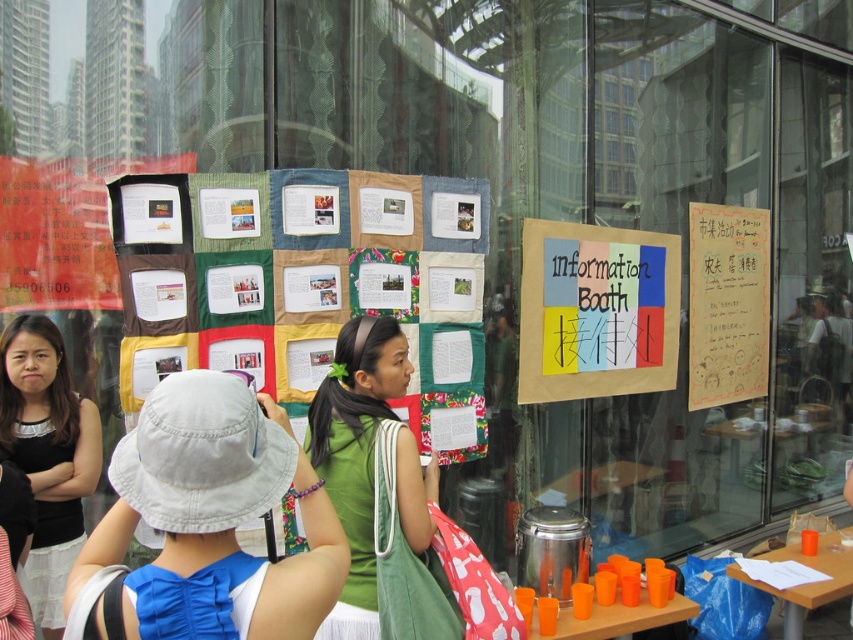
You are a photographer trying to capture a clear shot of the matte paper poster at center without any obstructions. The light gray fabric bucket hat at center is in the way. Based on their sizes, which object should you move closer to the camera to ensure the poster is visible?

The light gray fabric bucket hat at center is bigger than the matte paper poster at center. To make the poster visible, you should move the light gray fabric bucket hat at center closer to the camera so it appears smaller in the frame, allowing the matte paper poster at center to be seen clearly.

You are a photographer trying to capture a photo of the black fabric dress at left and the light gray fabric bucket hat at center. Since you want to ensure both are in focus, you need to know their heights. Which one is taller?

The light gray fabric bucket hat at center is shorter than the black fabric dress at left, so the black fabric dress at left is taller.